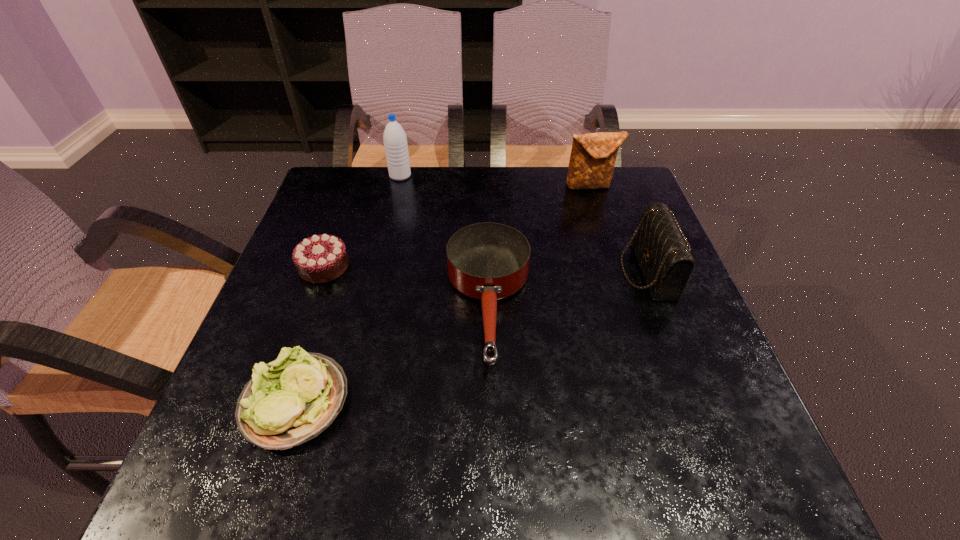
What are the coordinates of `empty space between the farther clutch bag and the lettuce` in the screenshot? It's located at (443, 294).

In order to click on vacant area between the lettuce and the chocolate cake in this screenshot , I will do `click(310, 334)`.

The image size is (960, 540). In order to click on free space between the taller clutch bag and the pan in this screenshot , I will do (540, 246).

Locate an element on the screen. This screenshot has width=960, height=540. empty space between the water bottle and the nearer clutch bag is located at coordinates (524, 223).

At what (x,y) coordinates should I click in order to perform the action: click on free space between the water bottle and the nearer clutch bag. Please return your answer as a coordinate pair (x, y). This screenshot has width=960, height=540. Looking at the image, I should click on (524, 223).

Where is `free space between the water bottle and the farther clutch bag`? This screenshot has width=960, height=540. free space between the water bottle and the farther clutch bag is located at coordinates (495, 181).

Locate an element on the screen. The image size is (960, 540). free space between the pan and the chocolate cake is located at coordinates (406, 286).

The image size is (960, 540). Find the location of `the fourth closest object relative to the water bottle`. the fourth closest object relative to the water bottle is located at coordinates (659, 244).

You are a GUI agent. You are given a task and a screenshot of the screen. Output one action in this format:
    pyautogui.click(x=<x>, y=<y>)
    Task: Click on the object that can be found as the closest to the third object from right to left
    This screenshot has height=540, width=960.
    Given the screenshot: What is the action you would take?
    (x=293, y=399)